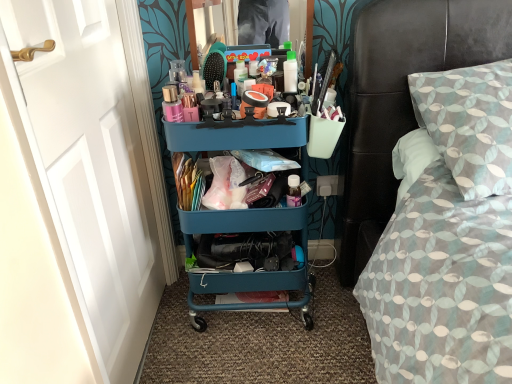
The width and height of the screenshot is (512, 384). Identify the location of vacant space underneath white painted wood door at left (from a real-world perspective). (x=150, y=340).